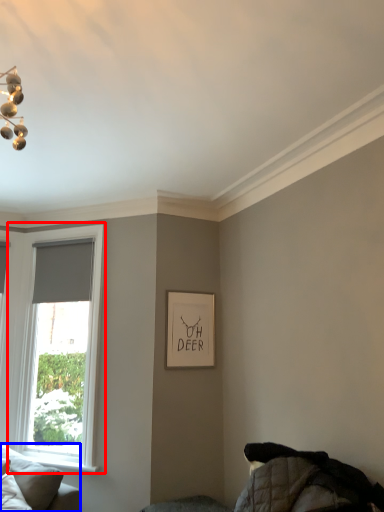
Question: Which point is closer to the camera, window (highlighted by a red box) or studio couch (highlighted by a blue box)?

Choices:
 (A) window
 (B) studio couch

Answer: (B)